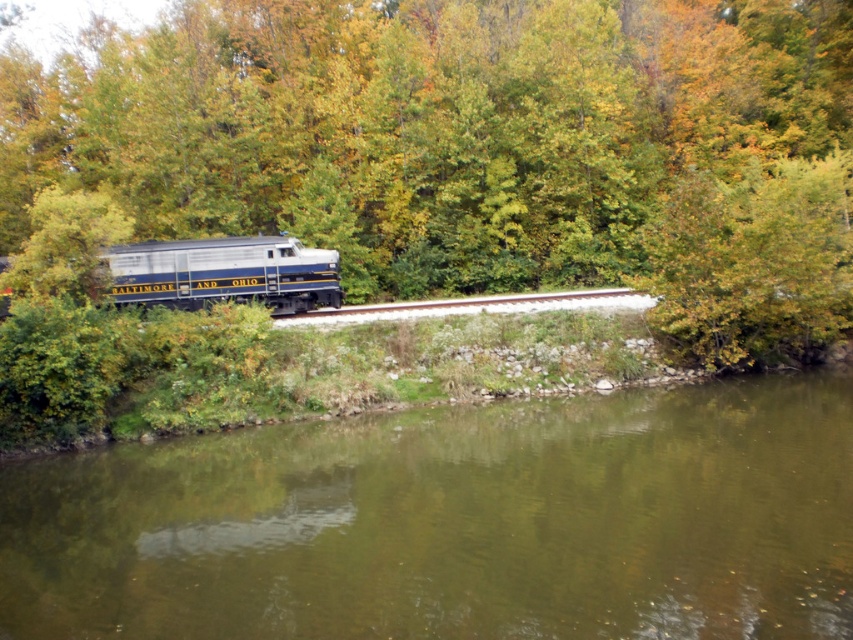
Question: Which is nearer to the green leafy tree at center?

Choices:
 (A) silver metallic locomotive at center
 (B) greenish-brown water at lower center
 (C) metal train track at center

Answer: (C)

Question: Which point appears closest to the camera in this image?

Choices:
 (A) (143, 262)
 (B) (811, 616)

Answer: (B)

Question: Can you confirm if greenish-brown water at lower center is positioned to the left of silver metallic locomotive at center?

Choices:
 (A) yes
 (B) no

Answer: (B)

Question: Which point is closer to the camera taking this photo?

Choices:
 (A) (577, 298)
 (B) (231, 291)
 (C) (502, 611)
 (D) (805, 32)

Answer: (C)

Question: Does greenish-brown water at lower center appear under metal train track at center?

Choices:
 (A) yes
 (B) no

Answer: (A)

Question: Does greenish-brown water at lower center appear on the left side of metal train track at center?

Choices:
 (A) yes
 (B) no

Answer: (A)